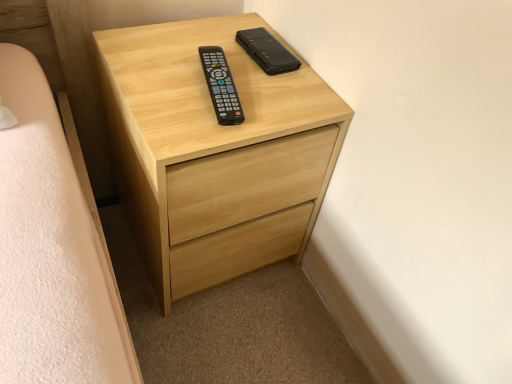
What do you see at coordinates (215, 152) in the screenshot? The height and width of the screenshot is (384, 512). I see `light wood chest of drawers at center` at bounding box center [215, 152].

I want to click on light wood chest of drawers at center, so click(215, 152).

What do you see at coordinates (267, 51) in the screenshot? I see `black leather phone case at upper center, positioned as the 2th control in front-to-back order` at bounding box center [267, 51].

Image resolution: width=512 pixels, height=384 pixels. I want to click on light wood chest of drawers at center, so click(x=215, y=152).

Is black leather phone case at upper center, positioned as the 2th control in front-to-back order, next to black plastic remote at center, which is counted as the 1th control, starting from the front?

black leather phone case at upper center, positioned as the 2th control in front-to-back order, and black plastic remote at center, which is counted as the 1th control, starting from the front, are clearly separated.

Could you measure the distance between black leather phone case at upper center, positioned as the 2th control in front-to-back order, and black plastic remote at center, the second control viewed from the back?

The distance of black leather phone case at upper center, positioned as the 2th control in front-to-back order, from black plastic remote at center, the second control viewed from the back, is 5.50 inches.

Is black leather phone case at upper center, positioned as the first control in back-to-front order, oriented towards black plastic remote at center, the second control viewed from the back?

No, black leather phone case at upper center, positioned as the first control in back-to-front order, is not aimed at black plastic remote at center, the second control viewed from the back.

How much distance is there between light wood chest of drawers at center and black leather phone case at upper center, positioned as the first control in back-to-front order?

light wood chest of drawers at center is 9.78 inches from black leather phone case at upper center, positioned as the first control in back-to-front order.

From the image's perspective, which is below, light wood chest of drawers at center or black leather phone case at upper center, positioned as the first control in back-to-front order?

light wood chest of drawers at center appears lower in the image.

In terms of width, does light wood chest of drawers at center look wider or thinner when compared to black leather phone case at upper center, positioned as the first control in back-to-front order?

Considering their sizes, light wood chest of drawers at center looks broader than black leather phone case at upper center, positioned as the first control in back-to-front order.

Considering the relative positions of light wood chest of drawers at center and black leather phone case at upper center, positioned as the 2th control in front-to-back order, in the image provided, is light wood chest of drawers at center behind black leather phone case at upper center, positioned as the 2th control in front-to-back order,?

No, it is in front of black leather phone case at upper center, positioned as the 2th control in front-to-back order.

What's the angular difference between light wood chest of drawers at center and black plastic remote at center, which is counted as the 1th control, starting from the front,'s facing directions?

The angular difference between light wood chest of drawers at center and black plastic remote at center, which is counted as the 1th control, starting from the front, is 9.61 degrees.

Is point (199, 237) closer or farther from the camera than point (228, 79)?

Point (199, 237) appears to be farther away from the viewer than point (228, 79).

Find the location of a particular element. chest of drawers on the left of black plastic remote at center, which is counted as the 1th control, starting from the front is located at coordinates (215, 152).

Measure the distance from light wood chest of drawers at center to black plastic remote at center, the second control viewed from the back.

light wood chest of drawers at center and black plastic remote at center, the second control viewed from the back, are 7.34 inches apart from each other.

Between black plastic remote at center, which is counted as the 1th control, starting from the front, and light wood chest of drawers at center, which one appears on the left side from the viewer's perspective?

light wood chest of drawers at center is more to the left.

Is the surface of black plastic remote at center, the second control viewed from the back, in direct contact with light wood chest of drawers at center?

No, black plastic remote at center, the second control viewed from the back, is not making contact with light wood chest of drawers at center.

Is black plastic remote at center, which is counted as the 1th control, starting from the front, smaller than light wood chest of drawers at center?

Yes.

What's the angular difference between black plastic remote at center, which is counted as the 1th control, starting from the front, and light wood chest of drawers at center's facing directions?

9.61 degrees.

Considering the relative positions of black leather phone case at upper center, positioned as the 2th control in front-to-back order, and light wood chest of drawers at center in the image provided, is black leather phone case at upper center, positioned as the 2th control in front-to-back order, in front of light wood chest of drawers at center?

No, it is behind light wood chest of drawers at center.

The image size is (512, 384). I want to click on the chest of drawers in front of the black leather phone case at upper center, positioned as the first control in back-to-front order, so click(x=215, y=152).

Is black leather phone case at upper center, positioned as the first control in back-to-front order, inside or outside of light wood chest of drawers at center?

black leather phone case at upper center, positioned as the first control in back-to-front order, fits inside light wood chest of drawers at center.

Can you confirm if black leather phone case at upper center, positioned as the first control in back-to-front order, is positioned to the left of light wood chest of drawers at center?

No, black leather phone case at upper center, positioned as the first control in back-to-front order, is not to the left of light wood chest of drawers at center.

Which is further, (211, 98) or (282, 64)?

The point (282, 64) is farther from the camera.

Between black plastic remote at center, the second control viewed from the back, and black leather phone case at upper center, positioned as the first control in back-to-front order, which one appears on the left side from the viewer's perspective?

black plastic remote at center, the second control viewed from the back.

The image size is (512, 384). Identify the location of control in front of the black leather phone case at upper center, positioned as the 2th control in front-to-back order. (221, 86).

You are a GUI agent. You are given a task and a screenshot of the screen. Output one action in this format:
    pyautogui.click(x=<x>, y=<y>)
    Task: Click on the control lying in front of the black leather phone case at upper center, positioned as the 2th control in front-to-back order
    
    Given the screenshot: What is the action you would take?
    pyautogui.click(x=221, y=86)

Locate an element on the screen. This screenshot has width=512, height=384. chest of drawers on the left side of black leather phone case at upper center, positioned as the 2th control in front-to-back order is located at coordinates (215, 152).

From the image, which object appears to be nearer to light wood chest of drawers at center, black plastic remote at center, the second control viewed from the back, or black leather phone case at upper center, positioned as the 2th control in front-to-back order?

black plastic remote at center, the second control viewed from the back.

Looking at this image, when comparing their distances from light wood chest of drawers at center, does black leather phone case at upper center, positioned as the first control in back-to-front order, or black plastic remote at center, which is counted as the 1th control, starting from the front, seem further?

Among the two, black leather phone case at upper center, positioned as the first control in back-to-front order, is located further to light wood chest of drawers at center.

Based on their spatial positions, is light wood chest of drawers at center or black leather phone case at upper center, positioned as the first control in back-to-front order, closer to black plastic remote at center, the second control viewed from the back?

The object closer to black plastic remote at center, the second control viewed from the back, is black leather phone case at upper center, positioned as the first control in back-to-front order.

Considering their positions, is black leather phone case at upper center, positioned as the first control in back-to-front order, positioned further to black plastic remote at center, which is counted as the 1th control, starting from the front, than light wood chest of drawers at center?

light wood chest of drawers at center is further to black plastic remote at center, which is counted as the 1th control, starting from the front.

Based on their spatial positions, is light wood chest of drawers at center or black plastic remote at center, the second control viewed from the back, closer to black leather phone case at upper center, positioned as the 2th control in front-to-back order?

Based on the image, black plastic remote at center, the second control viewed from the back, appears to be nearer to black leather phone case at upper center, positioned as the 2th control in front-to-back order.

From the image, which object appears to be nearer to black leather phone case at upper center, positioned as the first control in back-to-front order, black plastic remote at center, which is counted as the 1th control, starting from the front, or light wood chest of drawers at center?

black plastic remote at center, which is counted as the 1th control, starting from the front.

This screenshot has height=384, width=512. Identify the location of control between black leather phone case at upper center, positioned as the first control in back-to-front order, and light wood chest of drawers at center vertically. (221, 86).